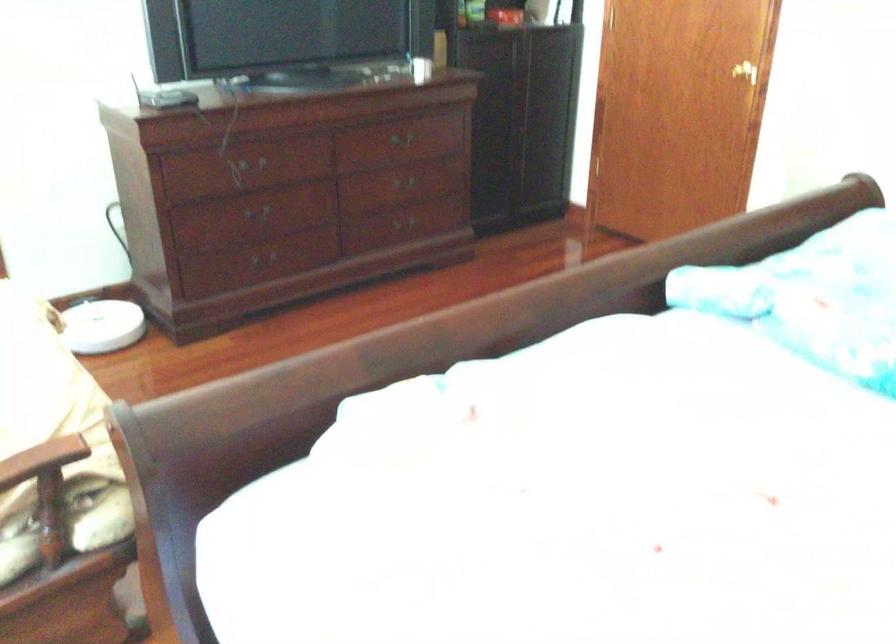
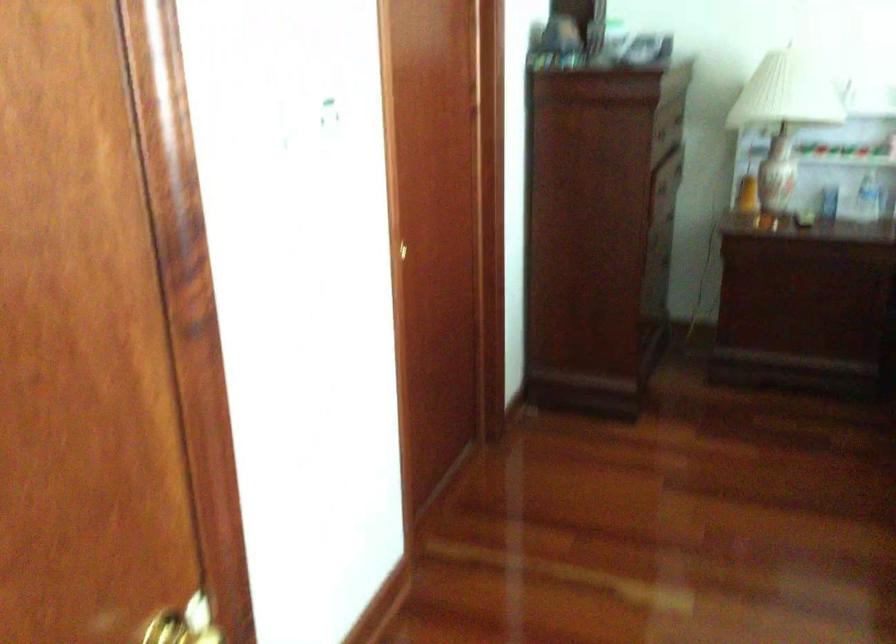
Find the pixel in the second image that matches [753,75] in the first image.

(185, 623)